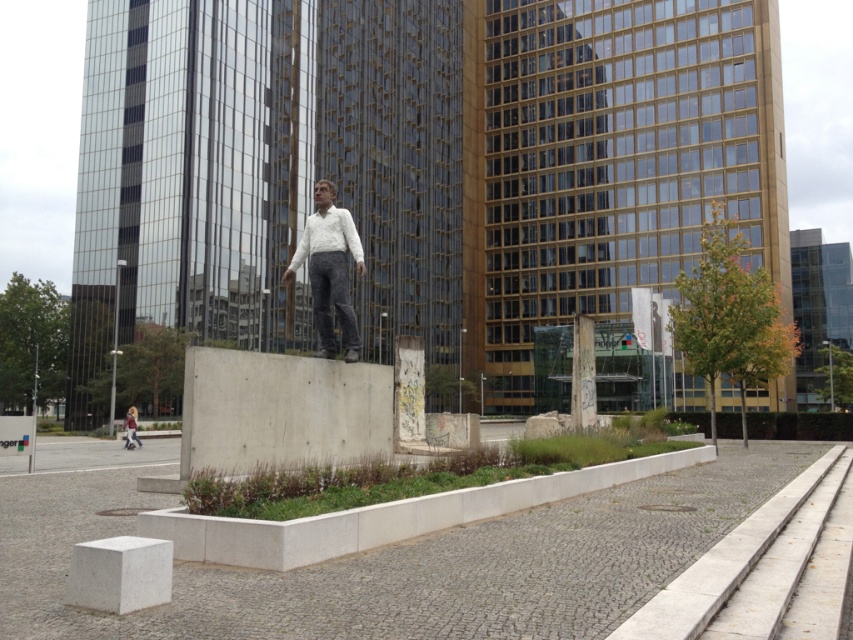
Based on the scene description, where is the concrete at center located in terms of its 2D coordinates?

The concrete at center is located at the 2D coordinates point (779,564).

You are a delivery person who needs to place a light brown leather jacket at lower left on a surface that is taller than it. Is the white concrete block at lower left a suitable surface for this task?

The white concrete block at lower left is shorter than the light brown leather jacket at lower left, so it is not tall enough to place the jacket on top. You need a taller surface.

You are standing at the edge of the pathway near the white concrete block at lower left. You want to place a 2.5 meter long bench here. Is there enough space between you and the block to fit the bench?

The distance between the white concrete block at lower left and the viewer is 4.76 meters. Since the bench is 2.5 meters long, there is sufficient space to place it between the viewer and the block.